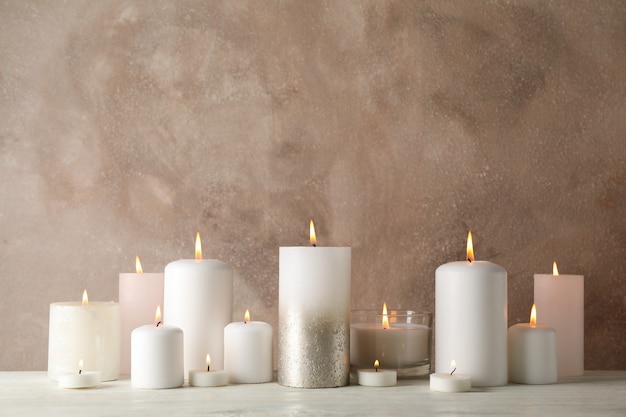
Where is `first five candles from the left`? This screenshot has height=417, width=626. first five candles from the left is located at coordinates (86, 380), (86, 344), (135, 312), (146, 354), (192, 309).